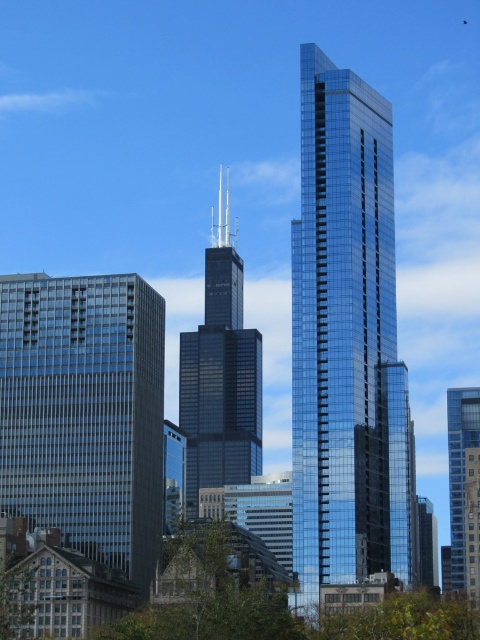
Can you confirm if glassy reflective skyscraper at left is positioned to the left of glassy blue skyscraper at right?

Yes, glassy reflective skyscraper at left is to the left of glassy blue skyscraper at right.

Is glassy reflective skyscraper at left closer to camera compared to glassy blue skyscraper at right?

Yes, glassy reflective skyscraper at left is closer to the viewer.

Is point (71, 330) positioned behind point (474, 412)?

That is False.

Where is `glassy reflective skyscraper at left`? Image resolution: width=480 pixels, height=640 pixels. glassy reflective skyscraper at left is located at coordinates (84, 413).

Does point (21, 314) come in front of point (217, 401)?

Yes, it is in front of point (217, 401).

Describe the element at coordinates (84, 413) in the screenshot. The width and height of the screenshot is (480, 640). I see `glassy reflective skyscraper at left` at that location.

Describe the element at coordinates (84, 413) in the screenshot. I see `glassy reflective skyscraper at left` at that location.

This screenshot has width=480, height=640. I want to click on glassy reflective skyscraper at left, so click(84, 413).

Can you confirm if shiny glass skyscraper at center is taller than green leafy tree at lower left?

Indeed, shiny glass skyscraper at center has a greater height compared to green leafy tree at lower left.

Is point (352, 556) positioned after point (1, 584)?

Yes, point (352, 556) is farther from viewer.

Which is behind, point (310, 515) or point (1, 612)?

The point (310, 515) is behind.

Locate an element on the screen. The width and height of the screenshot is (480, 640). shiny glass skyscraper at center is located at coordinates (347, 342).